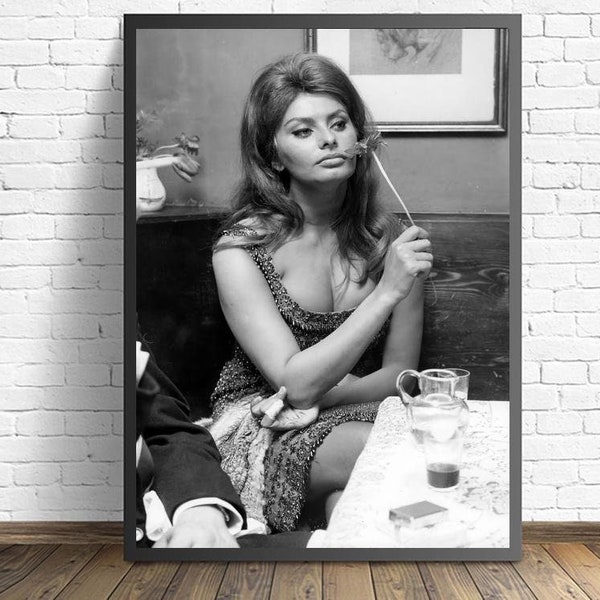
Where is `pitcher of water`? pitcher of water is located at coordinates (448, 394).